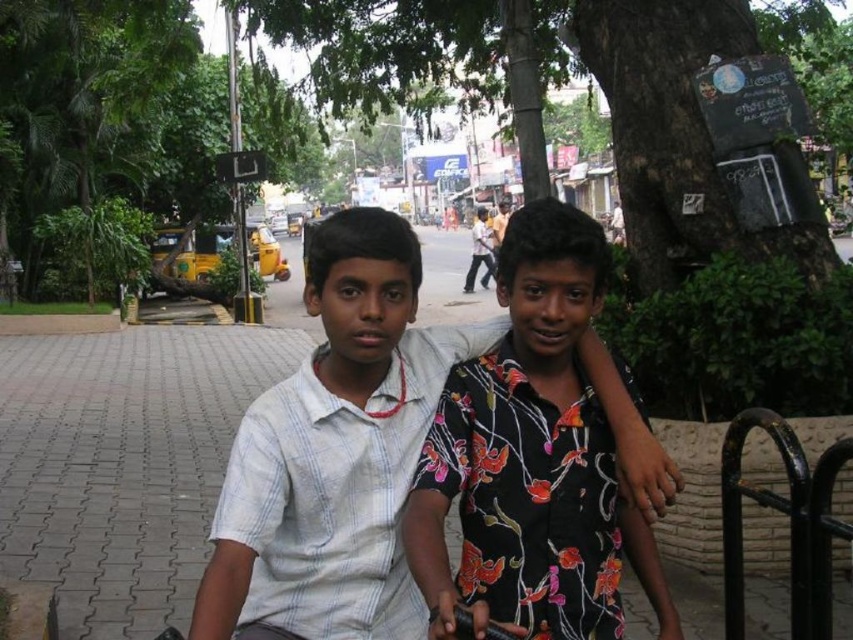
Does floral print shirt at center appear on the left side of black metal rail at lower right?

Indeed, floral print shirt at center is positioned on the left side of black metal rail at lower right.

Where is `floral print shirt at center`? The width and height of the screenshot is (853, 640). floral print shirt at center is located at coordinates (532, 458).

Which of these two, green leafy tree at center or black metal rail at lower right, stands shorter?

black metal rail at lower right is shorter.

Does green leafy tree at center lie behind black metal rail at lower right?

Yes, green leafy tree at center is further from the viewer.

Is point (537, 40) in front of point (799, 540)?

No, it is not.

Identify the location of green leafy tree at center. The height and width of the screenshot is (640, 853). (706, 212).

Does point (770, 401) come farther from viewer compared to point (500, 371)?

Yes, it is behind point (500, 371).

How far apart are green leafy tree at center and floral print shirt at center?

The distance of green leafy tree at center from floral print shirt at center is 4.11 meters.

What do you see at coordinates (706, 212) in the screenshot? I see `green leafy tree at center` at bounding box center [706, 212].

Where is `green leafy tree at center`? Image resolution: width=853 pixels, height=640 pixels. green leafy tree at center is located at coordinates (706, 212).